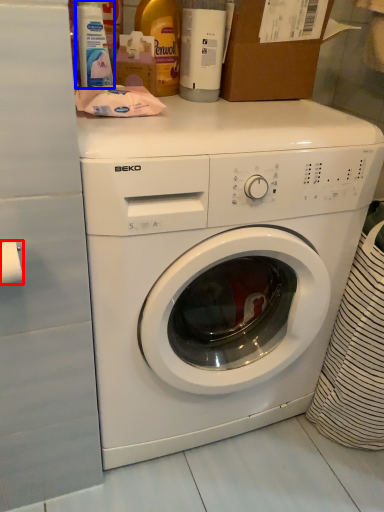
Question: Which point is further to the camera, toilet paper (highlighted by a red box) or cleaning product (highlighted by a blue box)?

Choices:
 (A) toilet paper
 (B) cleaning product

Answer: (B)